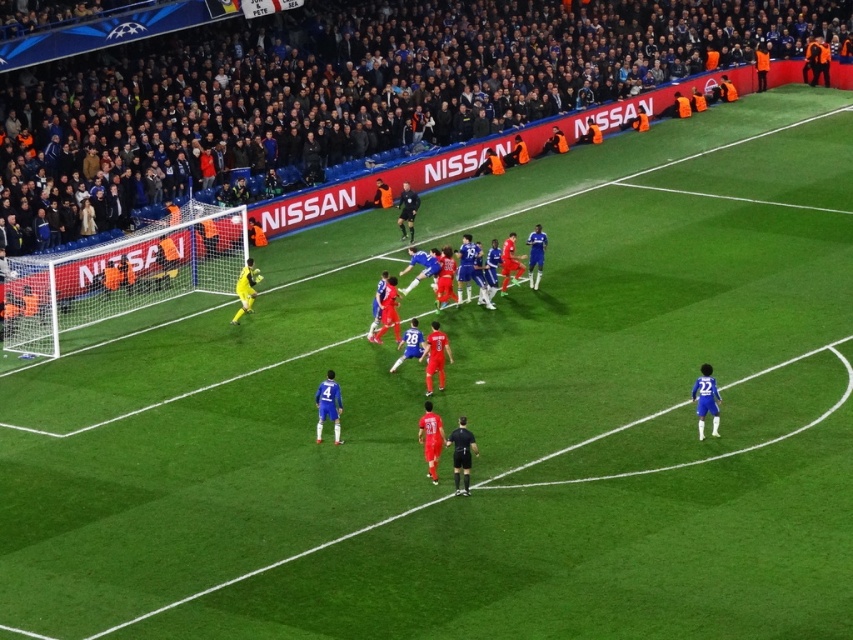
Does point (492, 76) come farther from viewer compared to point (434, 253)?

Yes, it is.

Which is behind, point (140, 202) or point (433, 326)?

The point (140, 202) is behind.

Which is in front, point (202, 77) or point (521, 256)?

Point (521, 256) is more forward.

Locate an element on the screen. This screenshot has width=853, height=640. dark blue fabric crowd at upper center is located at coordinates (352, 90).

Is point (65, 292) more distant than point (453, 456)?

Yes, point (65, 292) is farther from viewer.

Consider the image. Who is higher up, white mesh net at left or blue matte jersey at center?

Positioned higher is white mesh net at left.

Is point (4, 294) positioned behind point (430, 268)?

No, it is not.

Image resolution: width=853 pixels, height=640 pixels. In order to click on white mesh net at left in this screenshot , I will do `click(120, 276)`.

Can you confirm if dark blue fabric crowd at upper center is positioned to the left of white mesh net at left?

No, dark blue fabric crowd at upper center is not to the left of white mesh net at left.

Between dark blue fabric crowd at upper center and white mesh net at left, which one is positioned higher?

dark blue fabric crowd at upper center

This screenshot has height=640, width=853. Find the location of `dark blue fabric crowd at upper center`. dark blue fabric crowd at upper center is located at coordinates (352, 90).